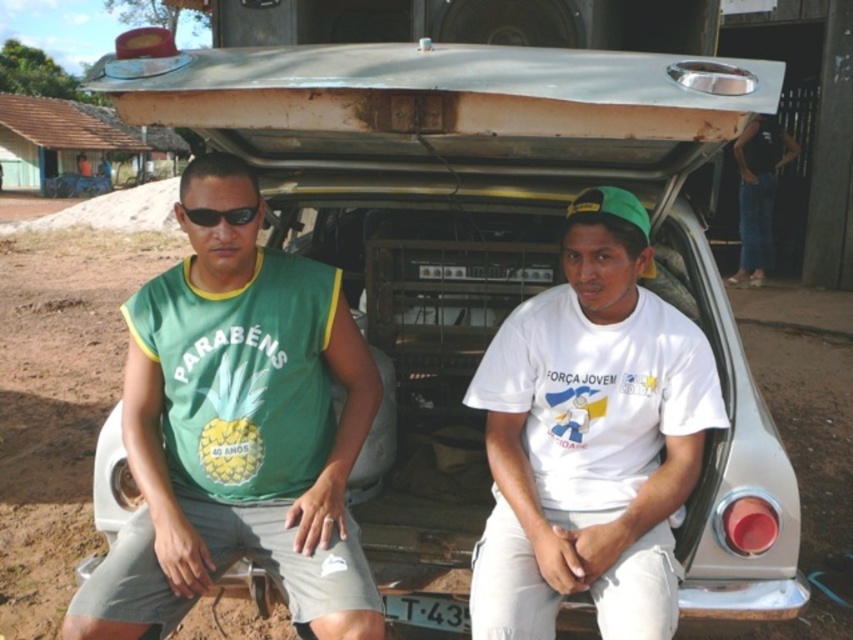
Consider the image. You are standing in front of the vintage car trunk. You notice two points marked in the image. Which point is closer to you, point (167,499) or point (541,604)?

Point (167,499) is closer to you than point (541,604).